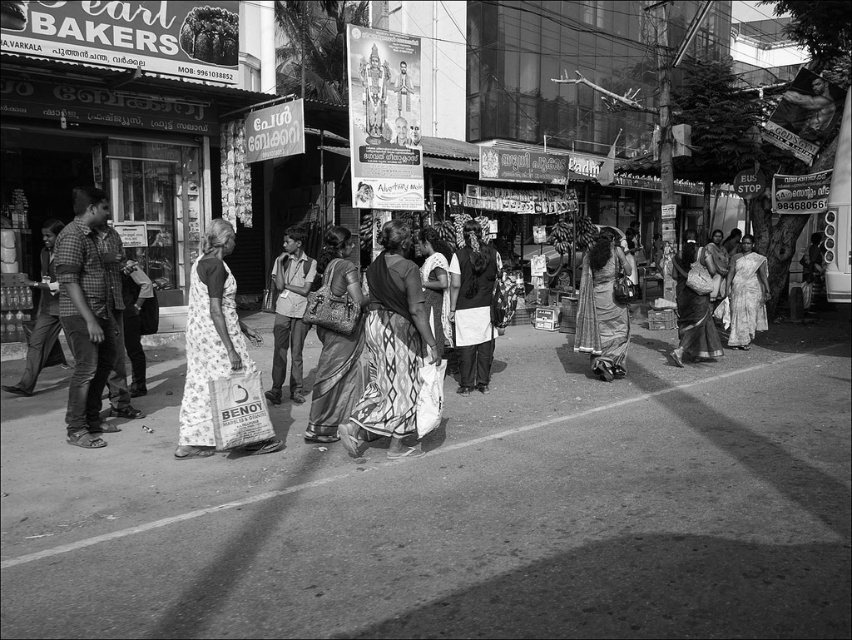
You are a fashion designer observing the bustling street scene described. You notice two women wearing traditional attire at the center of the image. Which woman is wearing the wider garment, the floral cotton sari at center or the silky white saree at center?

The floral cotton sari at center might be wider than silky white saree at center according to the description provided.

In the scene shown: You are standing at the camera position looking at the street scene. There are two points marked in the image, one at coordinates point [214,225] and the other at point [586,326]. Which of these two points is closer to your current position?

Point [214,225] is closer to the camera than point [586,326].

You are a tailor who needs to determine which sari is wider to decide which one to use for a client who requires a wider fabric. You see the printed cotton saree at center and the sari at center. Which one should you choose?

The sari at center is wider than the printed cotton saree at center, so you should choose the sari at center for the client who requires a wider fabric.